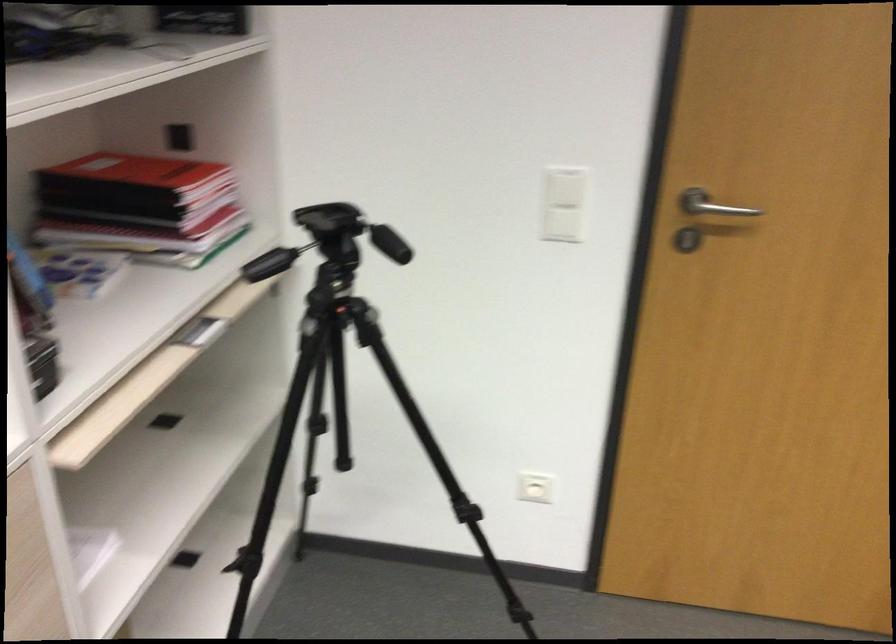
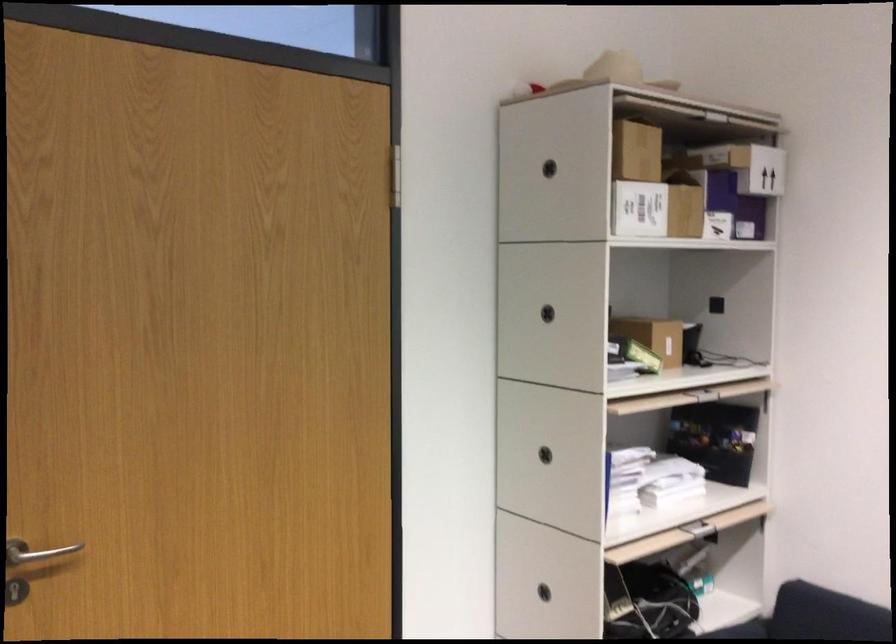
Question: The camera is either moving clockwise (left) or counter-clockwise (right) around the object. The first image is from the beginning of the video and the second image is from the end. Is the camera moving left or right when shooting the video?

Choices:
 (A) Left
 (B) Right

Answer: (A)